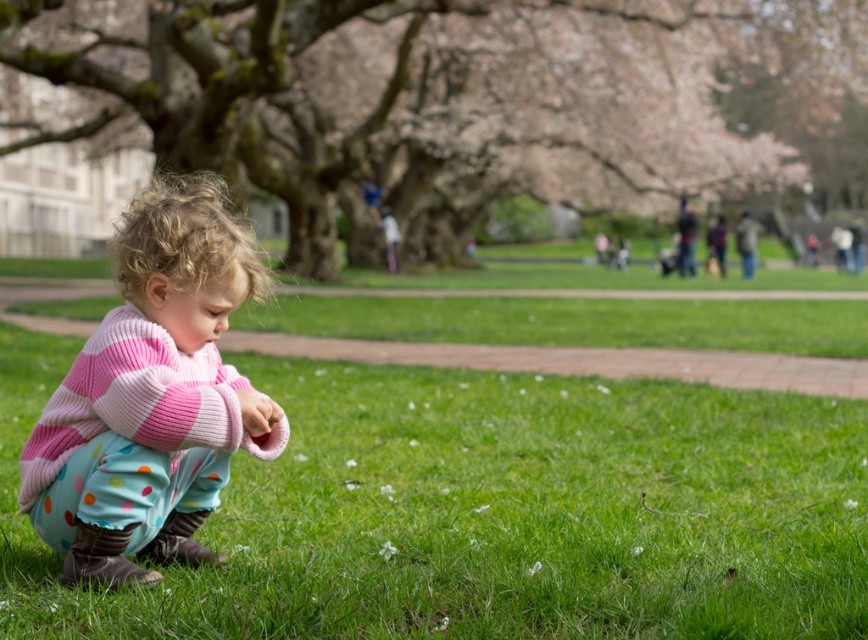
Does point (222, 36) come in front of point (212, 250)?

No, (222, 36) is behind (212, 250).

In the scene shown: Does rough bark tree at center have a smaller size compared to pink knitted sweater at center?

No, rough bark tree at center is not smaller than pink knitted sweater at center.

The width and height of the screenshot is (868, 640). Find the location of `rough bark tree at center`. rough bark tree at center is located at coordinates (464, 100).

Is green grass at lower left above rough bark tree at center?

Incorrect, green grass at lower left is not positioned above rough bark tree at center.

Who is lower down, green grass at lower left or rough bark tree at center?

green grass at lower left

Is point (487, 516) farther from viewer compared to point (595, 99)?

No.

What are the coordinates of `green grass at lower left` in the screenshot? It's located at (484, 512).

Looking at this image, is green grass at lower left bigger than pink knitted sweater at center?

Yes, green grass at lower left is bigger than pink knitted sweater at center.

Between green grass at lower left and pink knitted sweater at center, which one has less height?

green grass at lower left is shorter.

At what (x,y) coordinates should I click in order to perform the action: click on green grass at lower left. Please return your answer as a coordinate pair (x, y). The image size is (868, 640). Looking at the image, I should click on (484, 512).